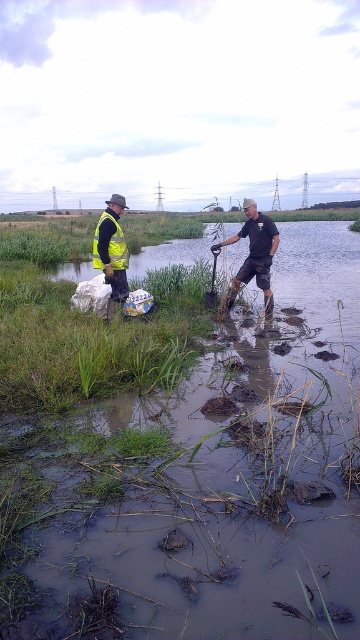
Question: Which of the following is the closest to the observer?

Choices:
 (A) (119, 243)
 (B) (234, 298)
 (C) (78, 554)

Answer: (C)

Question: Considering the relative positions of matte yellow vest at left and brown leather boots at lower center in the image provided, where is matte yellow vest at left located with respect to brown leather boots at lower center?

Choices:
 (A) above
 (B) below

Answer: (B)

Question: Is matte yellow vest at left above reflective yellow vest at left?

Choices:
 (A) no
 (B) yes

Answer: (A)

Question: Estimate the real-world distances between objects in this image. Which object is closer to the brown leather boots at lower center?

Choices:
 (A) matte yellow vest at left
 (B) reflective yellow vest at left
 (C) reflective yellow safety vest at left

Answer: (A)

Question: Which of these objects is positioned closest to the matte yellow vest at left?

Choices:
 (A) reflective yellow vest at left
 (B) brown leather boots at lower center
 (C) reflective yellow safety vest at left

Answer: (B)

Question: Can you confirm if brown leather boots at lower center is wider than reflective yellow vest at left?

Choices:
 (A) no
 (B) yes

Answer: (B)